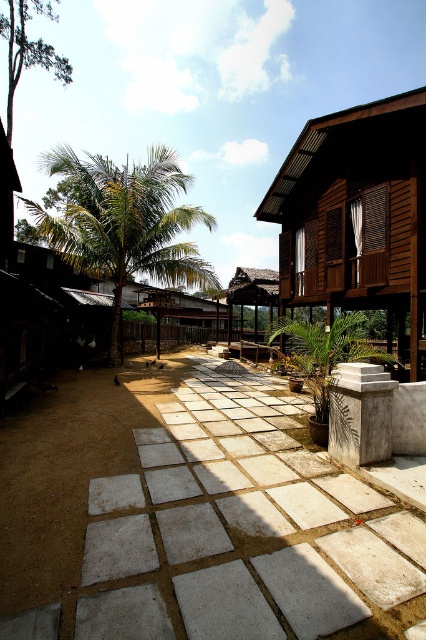
Question: In this image, where is green leafy palm tree at left located relative to rustic wooden hut at center?

Choices:
 (A) right
 (B) left

Answer: (B)

Question: Among these objects, which one is farthest from the camera?

Choices:
 (A) rustic wooden hut at center
 (B) green leafy palm tree at left
 (C) white concrete path at center
 (D) wooden house at right

Answer: (A)

Question: Among these points, which one is nearest to the camera?

Choices:
 (A) (72, 193)
 (B) (14, 540)
 (C) (360, 273)

Answer: (B)

Question: Where is wooden house at right located in relation to green leafy palm tree at left in the image?

Choices:
 (A) right
 (B) left

Answer: (A)

Question: Is white concrete path at center bigger than rustic wooden hut at center?

Choices:
 (A) yes
 (B) no

Answer: (B)

Question: Which point is farther to the camera?

Choices:
 (A) rustic wooden hut at center
 (B) white concrete path at center
 (C) wooden house at right
 (D) green leafy palm tree at left

Answer: (A)